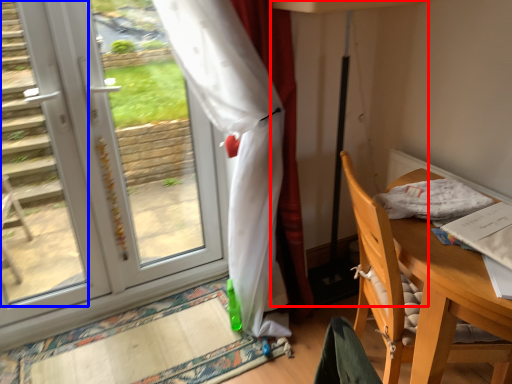
Question: Which of the following is the closest to the observer, table lamp (highlighted by a red box) or stair (highlighted by a blue box)?

Choices:
 (A) table lamp
 (B) stair

Answer: (B)